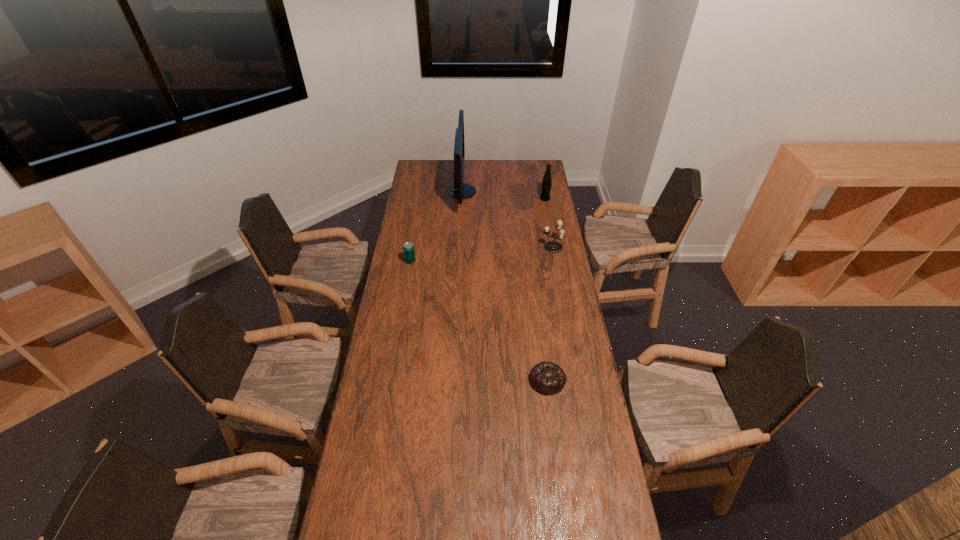
In the image, there is a desktop. Where is `vacant space at the left edge`? This screenshot has height=540, width=960. vacant space at the left edge is located at coordinates (412, 284).

The image size is (960, 540). In the image, there is a desktop. Find the location of `vacant space at the right edge`. vacant space at the right edge is located at coordinates (564, 486).

The image size is (960, 540). Identify the location of free space between the second object from left to right and the leftmost object. (437, 226).

Where is `free space that is in between the fourth object from right to left and the nearest object`? This screenshot has height=540, width=960. free space that is in between the fourth object from right to left and the nearest object is located at coordinates (505, 286).

Where is `free space between the beanbag and the third shortest object`? free space between the beanbag and the third shortest object is located at coordinates (550, 314).

Locate an element on the screen. Image resolution: width=960 pixels, height=540 pixels. free space between the beer bottle and the third farthest object is located at coordinates (548, 223).

The width and height of the screenshot is (960, 540). I want to click on vacant area between the computer monitor and the third tallest object, so click(x=508, y=219).

The image size is (960, 540). What are the coordinates of `empty location between the leftmost object and the beanbag` in the screenshot? It's located at (479, 321).

You are a GUI agent. You are given a task and a screenshot of the screen. Output one action in this format:
    pyautogui.click(x=<x>, y=<y>)
    Task: Click on the object that stands as the third closest to the third farthest object
    Image resolution: width=960 pixels, height=540 pixels.
    Given the screenshot: What is the action you would take?
    pyautogui.click(x=409, y=254)

This screenshot has width=960, height=540. Identify the location of object that is the third closest one to the tallest object. (551, 246).